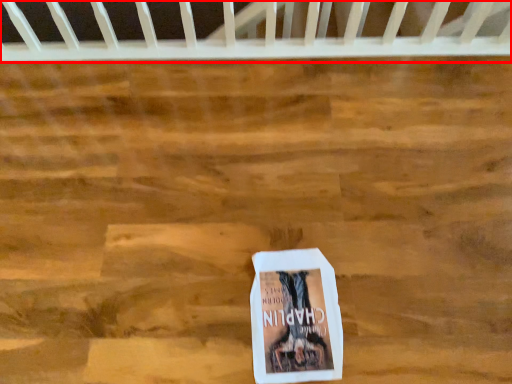
Question: Observing the image, what is the correct spatial positioning of infant bed (annotated by the red box) in reference to book?

Choices:
 (A) right
 (B) left

Answer: (B)